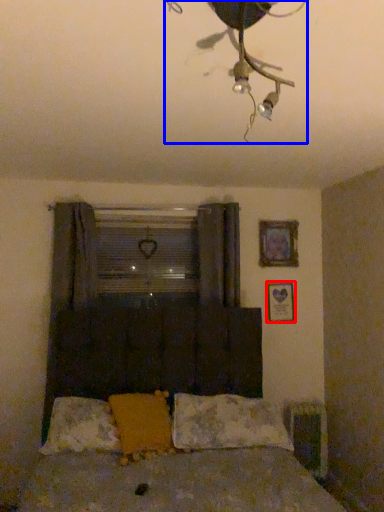
Question: Which point is further to the camera, picture frame (highlighted by a red box) or lamp (highlighted by a blue box)?

Choices:
 (A) picture frame
 (B) lamp

Answer: (A)